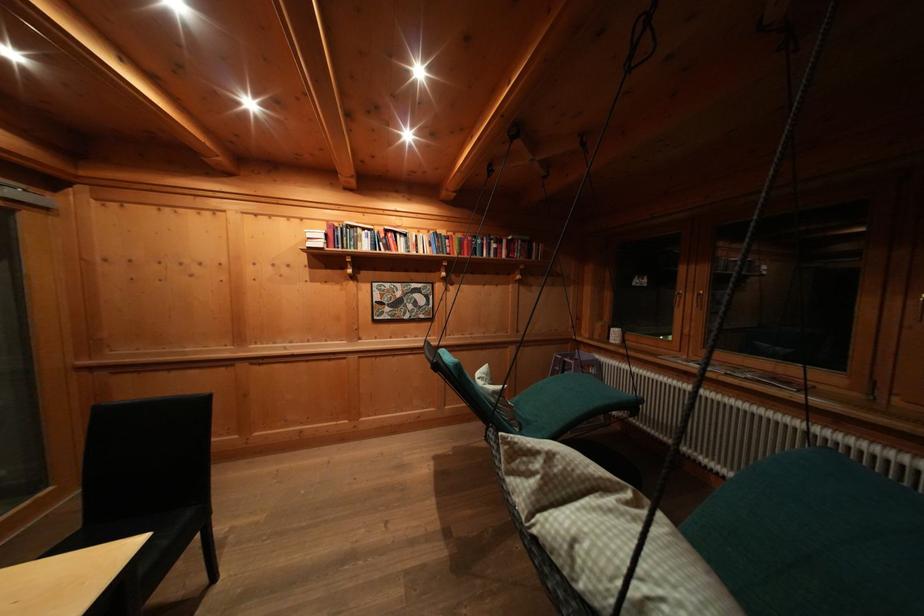
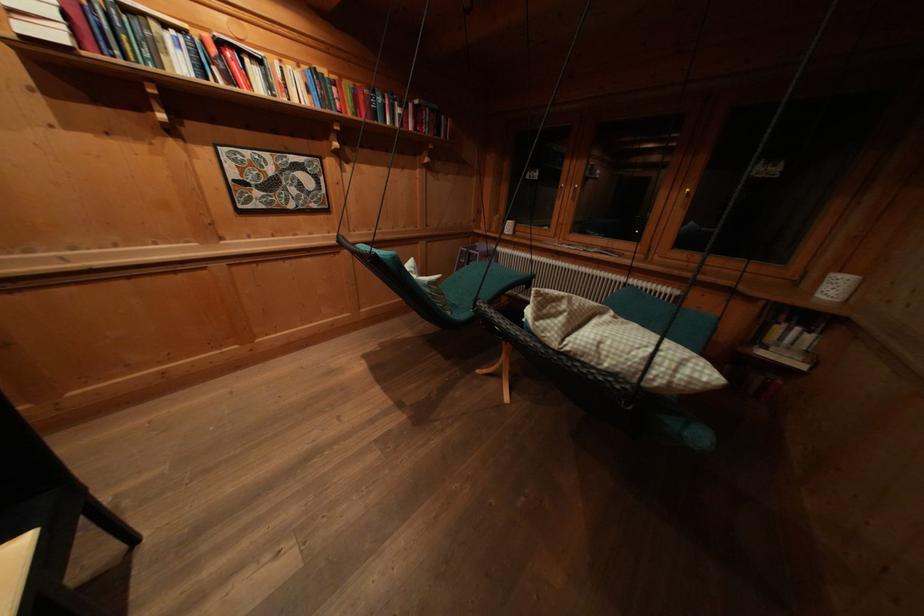
In the second image, find the point that corresponds to [393,236] in the first image.

(225, 47)